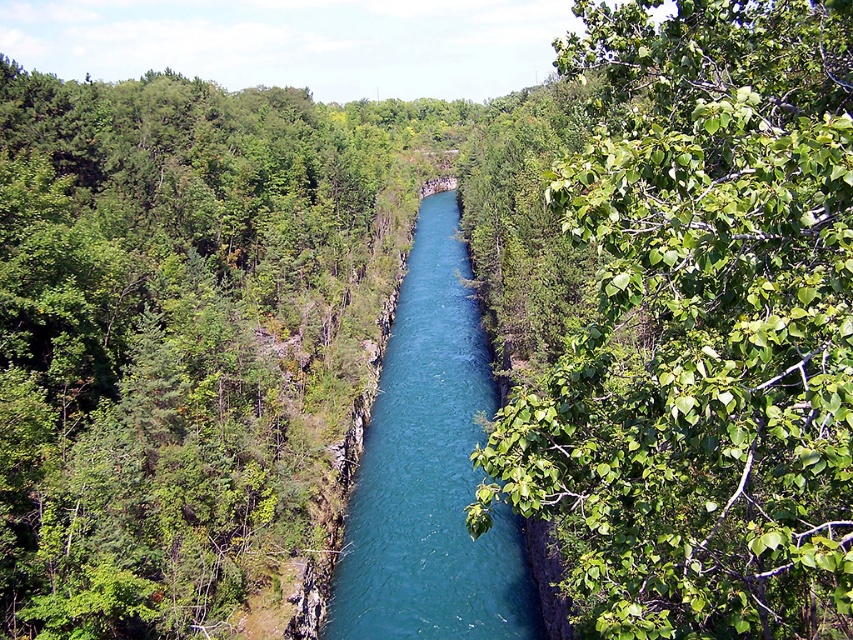
You are standing at the center of the canyon and want to locate the green leafy tree at center right. Which direction should you face to see it?

The green leafy tree at center right is located at point coordinates of (701, 330), so you should face towards the right side of the canyon to see it.

You are standing at the point marked as point [701,330] in the canyon. What object is exactly at your current location?

The green leafy tree at center right is located at point [701,330].